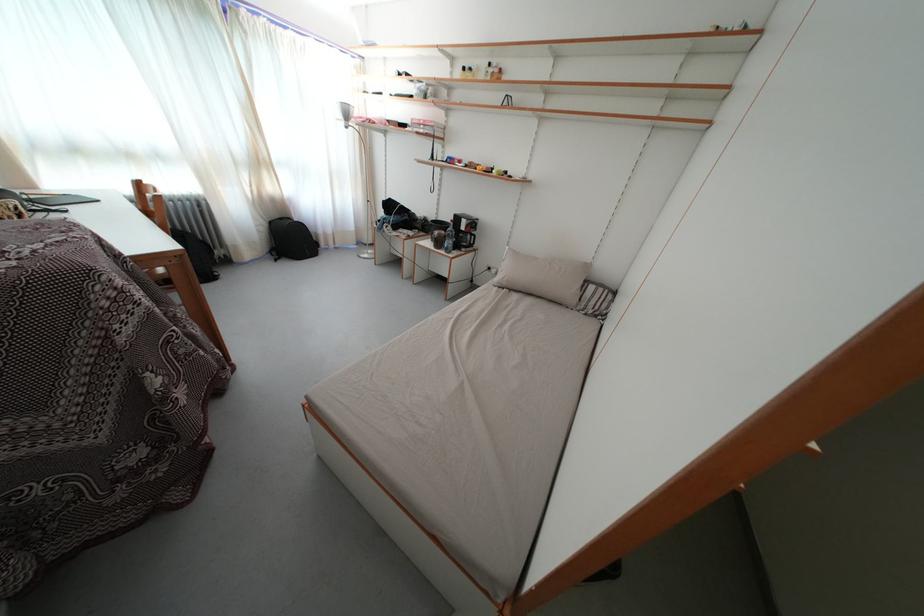
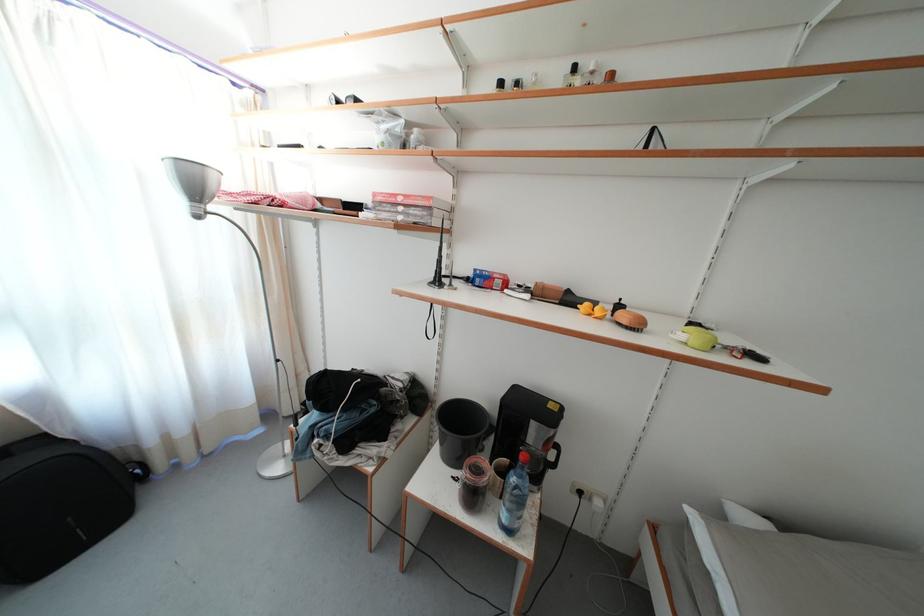
Question: Which direction would the cameraman need to move to produce the second image? Reply with the corresponding letter.

Choices:
 (A) Left
 (B) Right
 (C) Forward
 (D) Backward

Answer: (C)